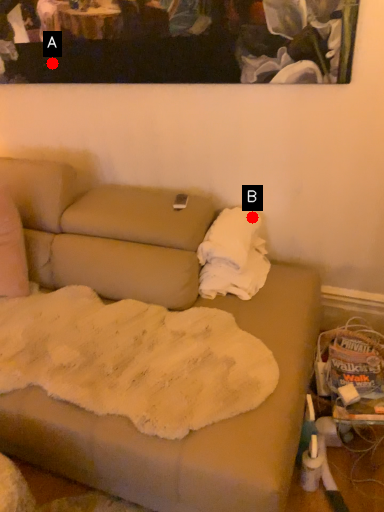
Question: Two points are circled on the image, labeled by A and B beside each circle. Among these points, which one is nearest to the camera?

Choices:
 (A) A is closer
 (B) B is closer

Answer: (B)